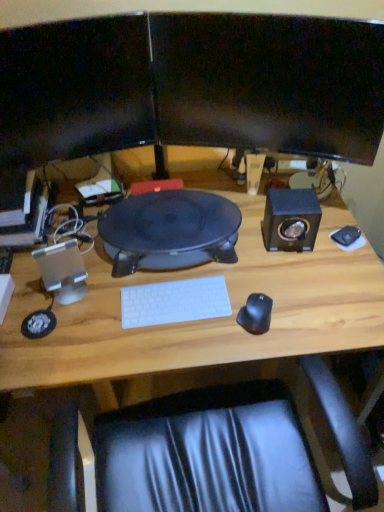
Where is `vacant space that is to the left of black matte speaker at right, arranged as the second speaker when ordered from the bottom`? The width and height of the screenshot is (384, 512). vacant space that is to the left of black matte speaker at right, arranged as the second speaker when ordered from the bottom is located at coordinates (241, 249).